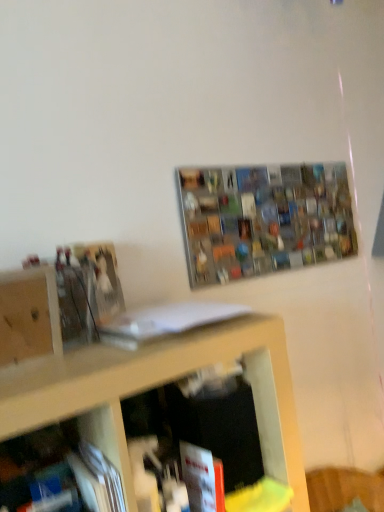
Question: From a real-world perspective, is wooden cabinet at left located beneath metallic grid at upper center?

Choices:
 (A) yes
 (B) no

Answer: (A)

Question: Considering the relative positions of wooden cabinet at left and metallic grid at upper center in the image provided, is wooden cabinet at left to the left of metallic grid at upper center from the viewer's perspective?

Choices:
 (A) yes
 (B) no

Answer: (A)

Question: Can you confirm if wooden cabinet at left is smaller than metallic grid at upper center?

Choices:
 (A) no
 (B) yes

Answer: (B)

Question: From the image's perspective, is wooden cabinet at left on metallic grid at upper center?

Choices:
 (A) yes
 (B) no

Answer: (B)

Question: From a real-world perspective, is wooden cabinet at left located higher than metallic grid at upper center?

Choices:
 (A) yes
 (B) no

Answer: (B)

Question: From the image's perspective, relative to metallic grid at upper center, is red matte book at lower center, the second book viewed from the top, above or below?

Choices:
 (A) above
 (B) below

Answer: (B)

Question: Looking at their shapes, would you say red matte book at lower center, the second book viewed from the top, is wider or thinner than metallic grid at upper center?

Choices:
 (A) wide
 (B) thin

Answer: (A)

Question: From a real-world perspective, relative to metallic grid at upper center, is red matte book at lower center, the second book viewed from the top, vertically above or below?

Choices:
 (A) above
 (B) below

Answer: (B)

Question: From their relative heights in the image, would you say red matte book at lower center, the second book viewed from the top, is taller or shorter than metallic grid at upper center?

Choices:
 (A) tall
 (B) short

Answer: (B)

Question: From the image's perspective, is white matte book at center, arranged as the second book when ordered from the bottom, located above or below red matte book at lower center, the second book viewed from the top?

Choices:
 (A) below
 (B) above

Answer: (B)

Question: From a real-world perspective, is white matte book at center, arranged as the second book when ordered from the bottom, above or below red matte book at lower center, which ranks as the 1th book in bottom-to-top order?

Choices:
 (A) above
 (B) below

Answer: (A)

Question: In the image, is white matte book at center, the first book in the top-to-bottom sequence, on the left side or the right side of red matte book at lower center, which ranks as the 1th book in bottom-to-top order?

Choices:
 (A) right
 (B) left

Answer: (B)

Question: Is white matte book at center, the first book in the top-to-bottom sequence, inside or outside of red matte book at lower center, the second book viewed from the top?

Choices:
 (A) outside
 (B) inside

Answer: (A)

Question: Is wooden cabinet at left bigger or smaller than red matte book at lower center, which ranks as the 1th book in bottom-to-top order?

Choices:
 (A) big
 (B) small

Answer: (A)

Question: From the image's perspective, is wooden cabinet at left positioned above or below red matte book at lower center, which ranks as the 1th book in bottom-to-top order?

Choices:
 (A) below
 (B) above

Answer: (B)